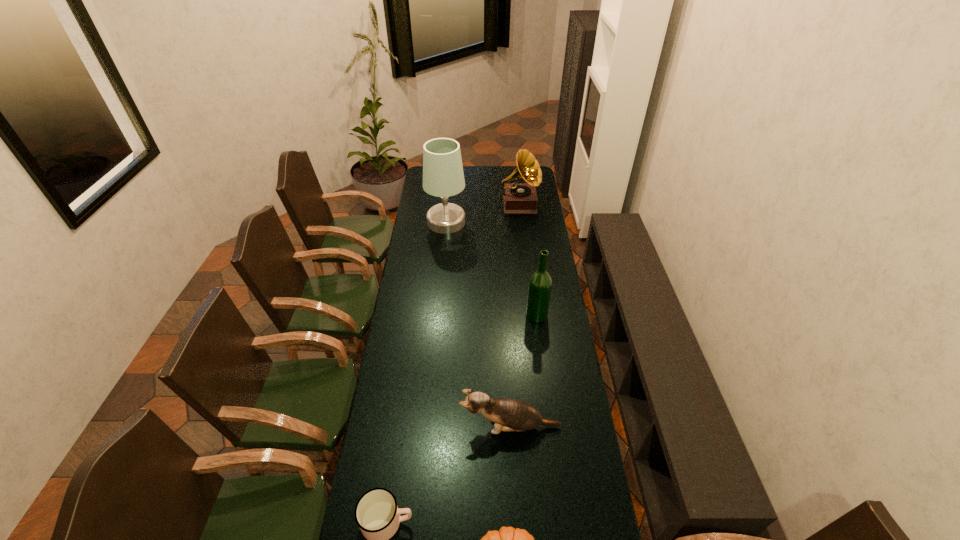
Image resolution: width=960 pixels, height=540 pixels. I want to click on the tallest object, so click(x=443, y=176).

Find the location of `phonograph record`. phonograph record is located at coordinates (518, 198).

Identify the location of alcohol. (540, 283).

Find the location of `the third nearest object`. the third nearest object is located at coordinates (515, 415).

This screenshot has width=960, height=540. I want to click on free space located 0.100m on the base of the lampshade, so click(x=484, y=222).

Locate an element on the screen. This screenshot has width=960, height=540. vacant space situated 0.380m from the horn of the phonograph record is located at coordinates (526, 268).

Where is `vacant space located on the front of the fourth nearest object`? vacant space located on the front of the fourth nearest object is located at coordinates (543, 370).

Find the location of `vacant space situated at the face of the third nearest object`. vacant space situated at the face of the third nearest object is located at coordinates [380, 427].

The image size is (960, 540). What are the coordinates of `free space located 0.080m at the face of the third nearest object` in the screenshot? It's located at (437, 427).

I want to click on free space located at the face of the third nearest object, so click(x=443, y=427).